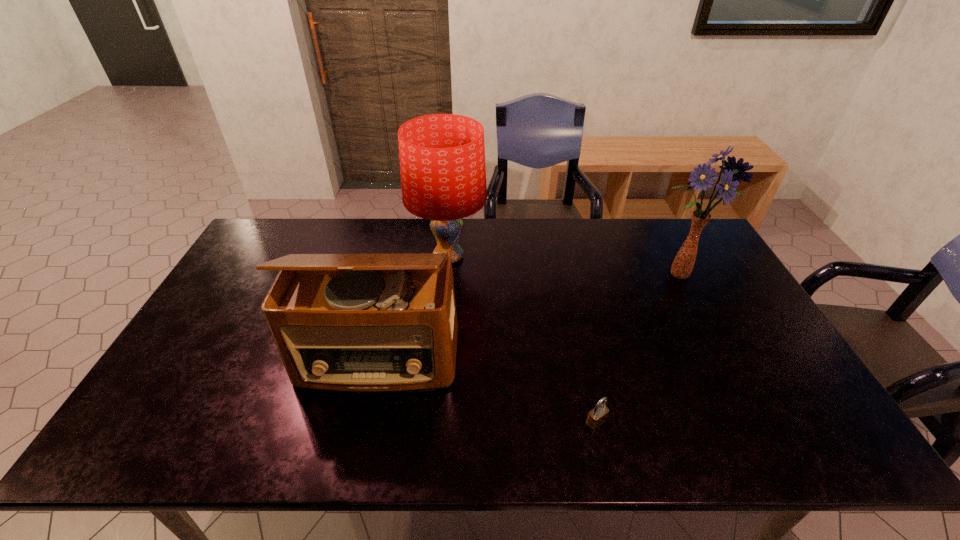
Locate an element on the screen. The height and width of the screenshot is (540, 960). lampshade is located at coordinates (442, 156).

The image size is (960, 540). Find the location of `the rightmost object`. the rightmost object is located at coordinates (682, 266).

The image size is (960, 540). In order to click on the third farthest object in this screenshot , I will do `click(368, 323)`.

Where is `radio receiver`? This screenshot has height=540, width=960. radio receiver is located at coordinates (368, 323).

This screenshot has width=960, height=540. Find the location of `padlock`. padlock is located at coordinates (597, 416).

What are the coordinates of `the nearest object` in the screenshot? It's located at (597, 416).

Identify the location of free spot located 0.180m on the front-facing side of the lampshade. This screenshot has width=960, height=540. (540, 256).

Locate an element on the screen. vacant region located 0.060m on the right of the flower arrangement is located at coordinates (728, 275).

Find the location of a particular element. This screenshot has width=960, height=540. free space located 0.110m on the front panel of the second shortest object is located at coordinates (362, 437).

This screenshot has height=540, width=960. Find the location of `free space located 0.390m on the back of the nearest object`. free space located 0.390m on the back of the nearest object is located at coordinates (569, 300).